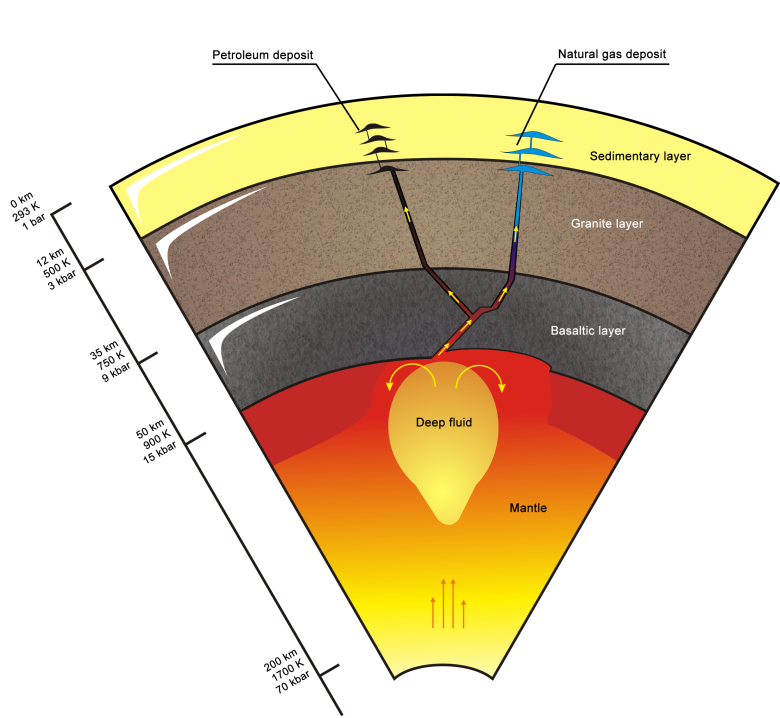
This screenshot has height=718, width=780. I want to click on brown arch, so click(x=296, y=238).